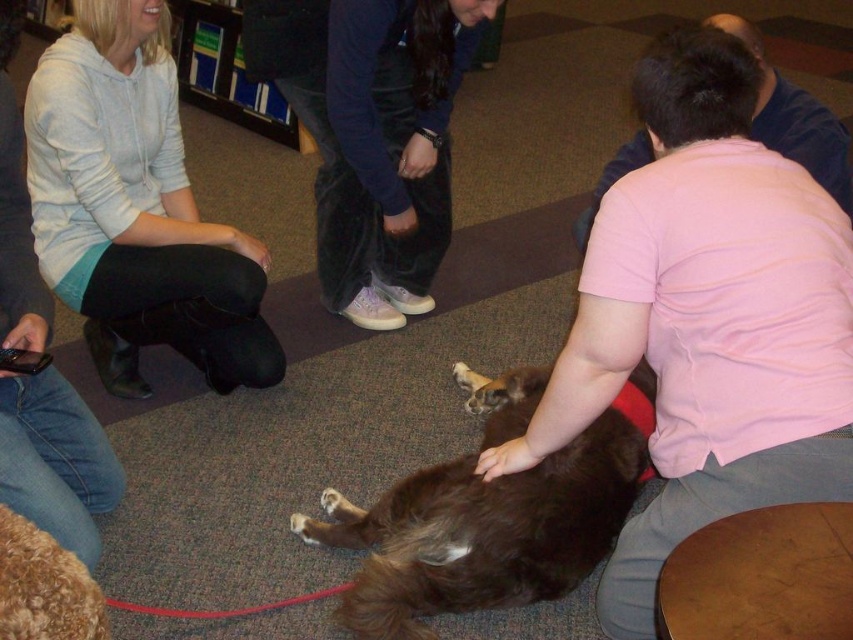
Between pink cotton shirt at lower right and curly golden fur dog at lower left, which one has more height?

pink cotton shirt at lower right is taller.

The image size is (853, 640). What do you see at coordinates (706, 320) in the screenshot?
I see `pink cotton shirt at lower right` at bounding box center [706, 320].

Locate an element on the screen. Image resolution: width=853 pixels, height=640 pixels. pink cotton shirt at lower right is located at coordinates (706, 320).

Between light blue hoodie at upper left and brown furry dog at center, which one has less height?

Standing shorter between the two is brown furry dog at center.

Does light blue hoodie at upper left have a greater height compared to brown furry dog at center?

Yes.

Is point (165, 65) positioned in front of point (351, 515)?

No, it is not.

Find the location of a particular element. This screenshot has height=640, width=853. light blue hoodie at upper left is located at coordinates (136, 209).

Can you confirm if pink cotton shirt at lower right is smaller than light blue hoodie at upper left?

Actually, pink cotton shirt at lower right might be larger than light blue hoodie at upper left.

Can you confirm if pink cotton shirt at lower right is shorter than light blue hoodie at upper left?

Incorrect, pink cotton shirt at lower right's height does not fall short of light blue hoodie at upper left's.

The height and width of the screenshot is (640, 853). Describe the element at coordinates (706, 320) in the screenshot. I see `pink cotton shirt at lower right` at that location.

The width and height of the screenshot is (853, 640). Find the location of `pink cotton shirt at lower right`. pink cotton shirt at lower right is located at coordinates (706, 320).